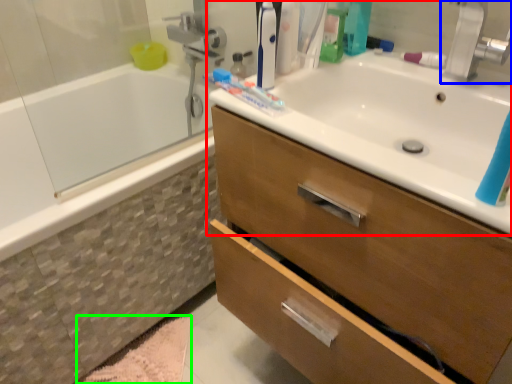
Question: Considering the real-world distances, which object is farthest from sink (highlighted by a red box)? tap (highlighted by a blue box) or bath mat (highlighted by a green box)?

Choices:
 (A) tap
 (B) bath mat

Answer: (B)